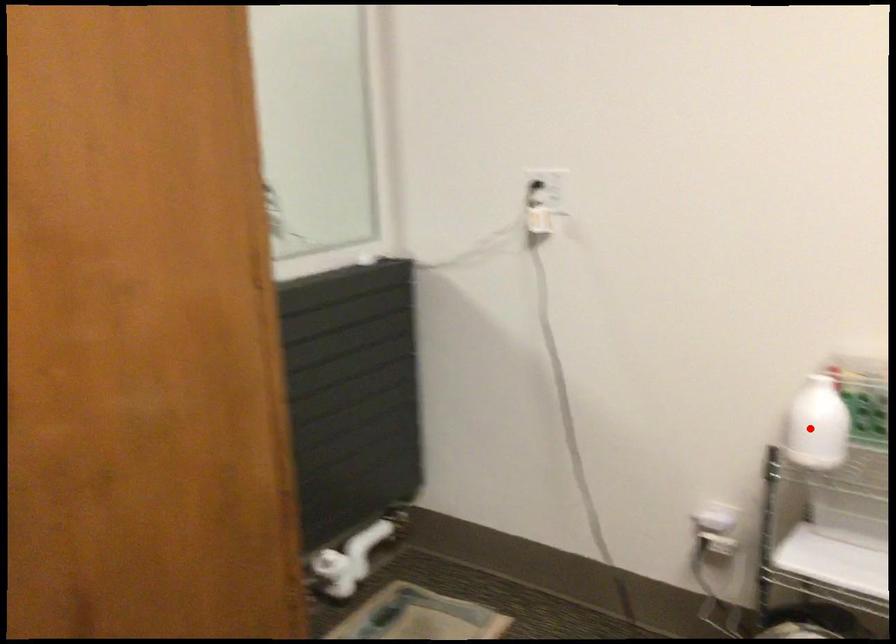
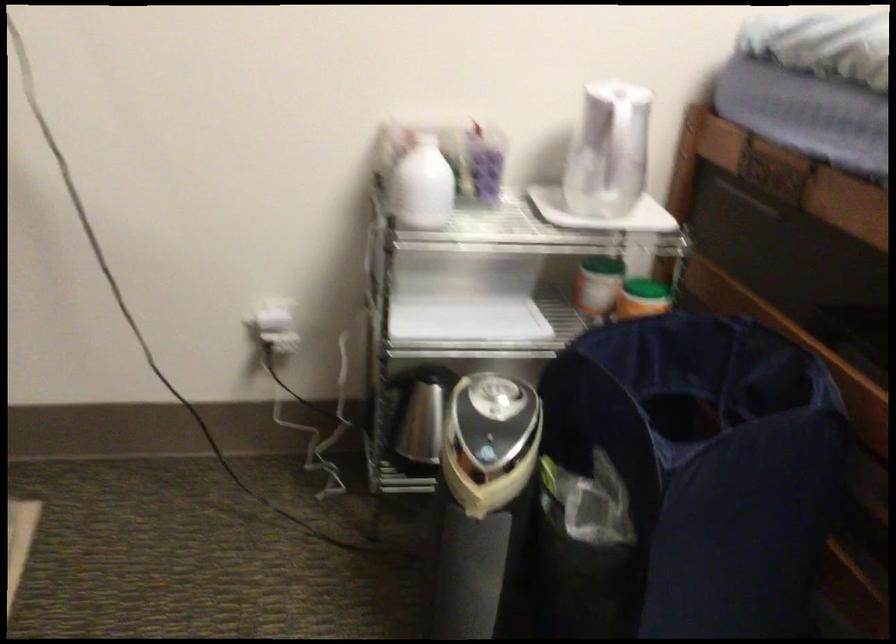
Locate, in the second image, the point that corresponds to the highlighted location in the first image.

(421, 185)